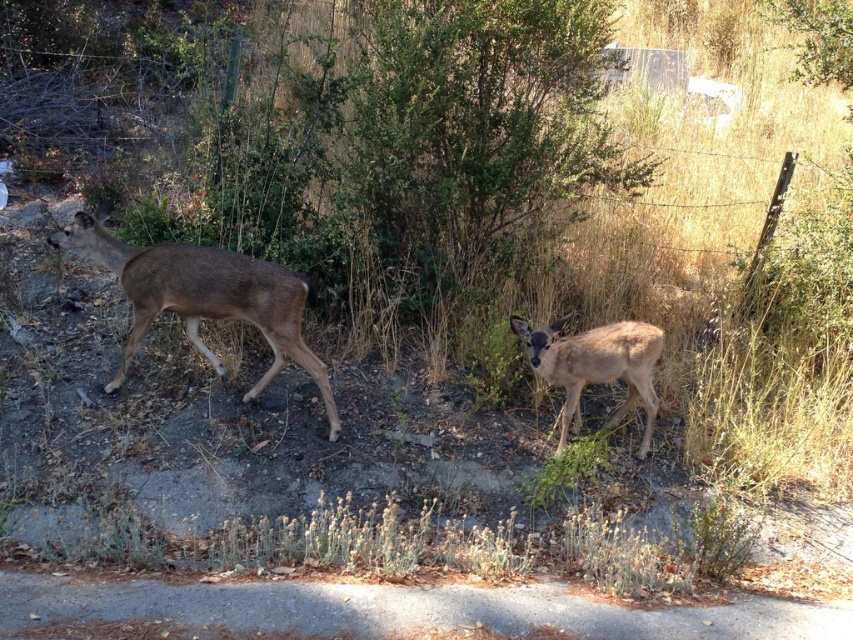
Question: Is brown matte/deer at left positioned behind brown matte deer at center?

Choices:
 (A) no
 (B) yes

Answer: (B)

Question: In this image, where is brown matte/deer at left located relative to brown matte deer at center?

Choices:
 (A) below
 (B) above

Answer: (B)

Question: Among these points, which one is farthest from the camera?

Choices:
 (A) (257, 384)
 (B) (567, 384)

Answer: (A)

Question: Observing the image, what is the correct spatial positioning of brown matte/deer at left in reference to brown matte deer at center?

Choices:
 (A) above
 (B) below

Answer: (A)

Question: Which point is farther to the camera?

Choices:
 (A) brown matte/deer at left
 (B) brown matte deer at center

Answer: (A)